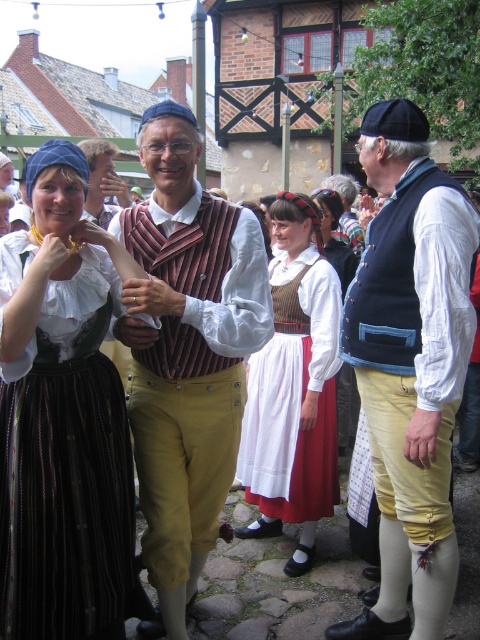
Is point (350, 288) farther from viewer compared to point (309, 298)?

No.

Which is more to the right, matte black vest at center or white cotton dress at center?

Positioned to the right is matte black vest at center.

Is point (472, 268) in front of point (265, 422)?

Yes.

I want to click on matte black vest at center, so click(409, 365).

Who is taller, matte black dirndl at left or matte black vest at center?

With more height is matte black dirndl at left.

You are a GUI agent. You are given a task and a screenshot of the screen. Output one action in this format:
    pyautogui.click(x=<x>, y=<y>)
    Task: Click on the matte black dirndl at left
    This screenshot has height=640, width=480.
    Given the screenshot: What is the action you would take?
    pyautogui.click(x=62, y=417)

This screenshot has height=640, width=480. I want to click on matte black dirndl at left, so click(x=62, y=417).

Between point (190, 275) and point (294, 420), which one is positioned in front?

Positioned in front is point (190, 275).

Does striped fabric vest at center appear under white cotton dress at center?

Incorrect, striped fabric vest at center is not positioned below white cotton dress at center.

What do you see at coordinates (187, 352) in the screenshot?
I see `striped fabric vest at center` at bounding box center [187, 352].

This screenshot has height=640, width=480. I want to click on striped fabric vest at center, so click(x=187, y=352).